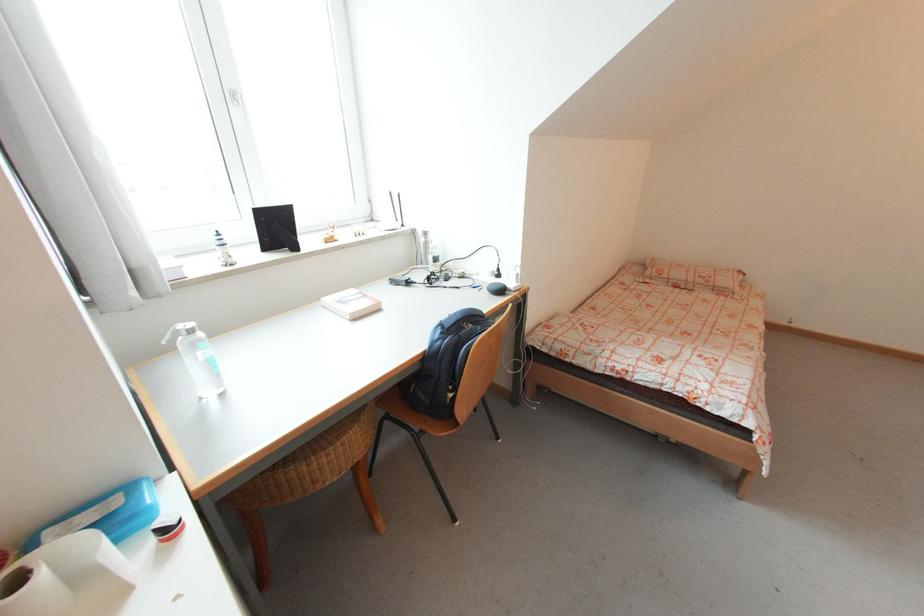
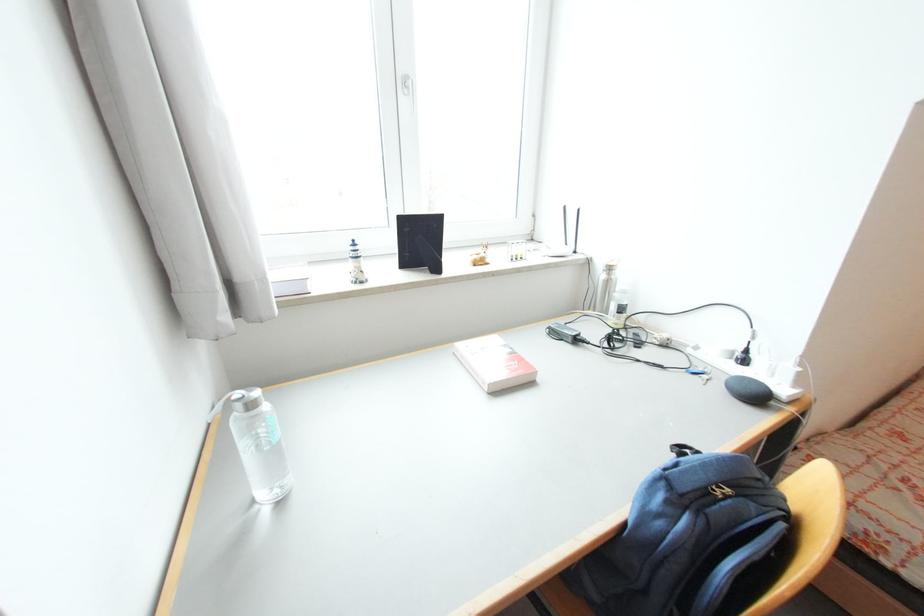
Find the pixel in the second image that matches point 188,333 in the first image.

(244, 407)